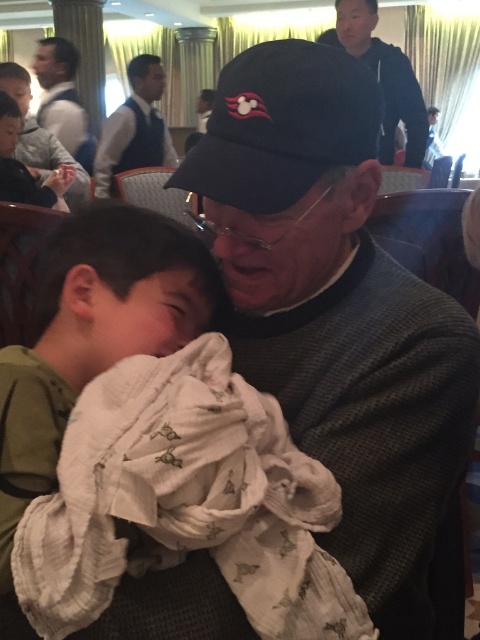
You are a photographer standing at the entrance of the restaurant. You want to take a photo of the dark blue sweater at upper center. Where should you position your camera to capture it best?

The dark blue sweater at upper center is located at point 0.122 on the x axis and 0.800 on the y axis, so position your camera slightly to the left and lower down to center the sweater in the frame.

You are a photographer trying to capture a candid shot of the scene. You notice the white cotton blanket at center and the black knitwear at center. Which object should you focus on if you want to include both in your frame but prioritize the taller one?

The black knitwear at center is taller than the white cotton blanket at center, so you should focus on the black knitwear at center to prioritize the taller object in your frame.